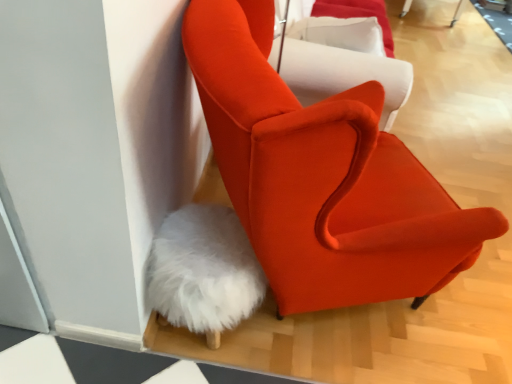
Question: From the image's perspective, is matte orange armchair at center, the second chair in the top-to-bottom sequence, positioned above or below orange fabric chair at upper center, which is the 1th chair in top-to-bottom order?

Choices:
 (A) above
 (B) below

Answer: (B)

Question: From a real-world perspective, is matte orange armchair at center, the second chair in the top-to-bottom sequence, above or below orange fabric chair at upper center, which is the 1th chair in top-to-bottom order?

Choices:
 (A) above
 (B) below

Answer: (B)

Question: Based on their sizes in the image, would you say matte orange armchair at center, the second chair in the top-to-bottom sequence, is bigger or smaller than orange fabric chair at upper center, which is the 1th chair in top-to-bottom order?

Choices:
 (A) big
 (B) small

Answer: (A)

Question: Would you say orange fabric chair at upper center, which is the 1th chair in top-to-bottom order, is inside or outside matte orange armchair at center, which appears as the first chair when ordered from the bottom?

Choices:
 (A) inside
 (B) outside

Answer: (B)

Question: Based on their positions, is orange fabric chair at upper center, which is the 1th chair in top-to-bottom order, located to the left or right of matte orange armchair at center, which appears as the first chair when ordered from the bottom?

Choices:
 (A) right
 (B) left

Answer: (A)

Question: In terms of height, does orange fabric chair at upper center, which is the 1th chair in top-to-bottom order, look taller or shorter compared to matte orange armchair at center, which appears as the first chair when ordered from the bottom?

Choices:
 (A) tall
 (B) short

Answer: (B)

Question: Is point (402, 87) closer or farther from the camera than point (262, 244)?

Choices:
 (A) farther
 (B) closer

Answer: (A)